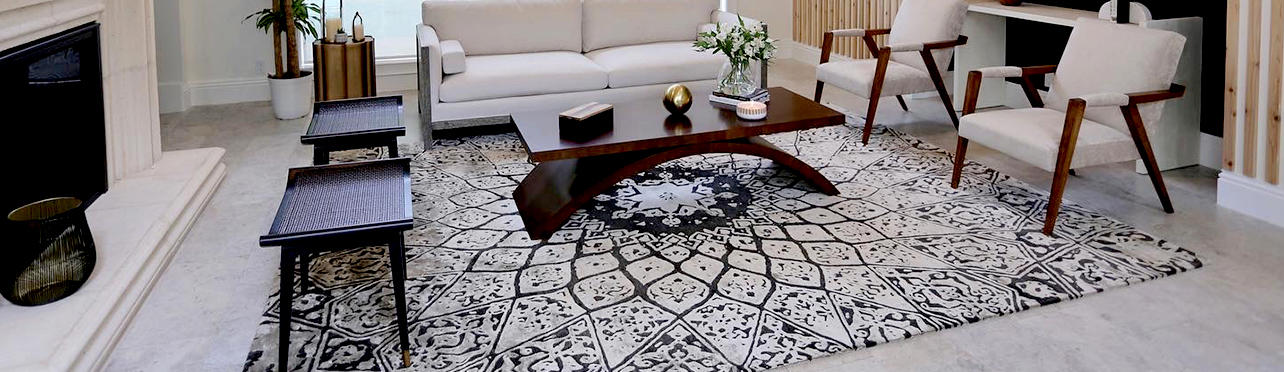
The image size is (1284, 372). What are the coordinates of `basket` in the screenshot? It's located at (45, 258).